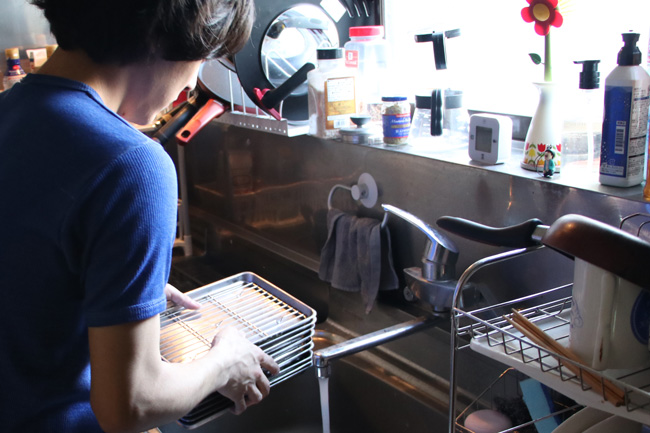
At what (x,y) coordinates should I click in order to perform the action: click on stack of pans. Please return your answer as a coordinate pair (x, y). This screenshot has height=433, width=650. Looking at the image, I should click on (250, 317).